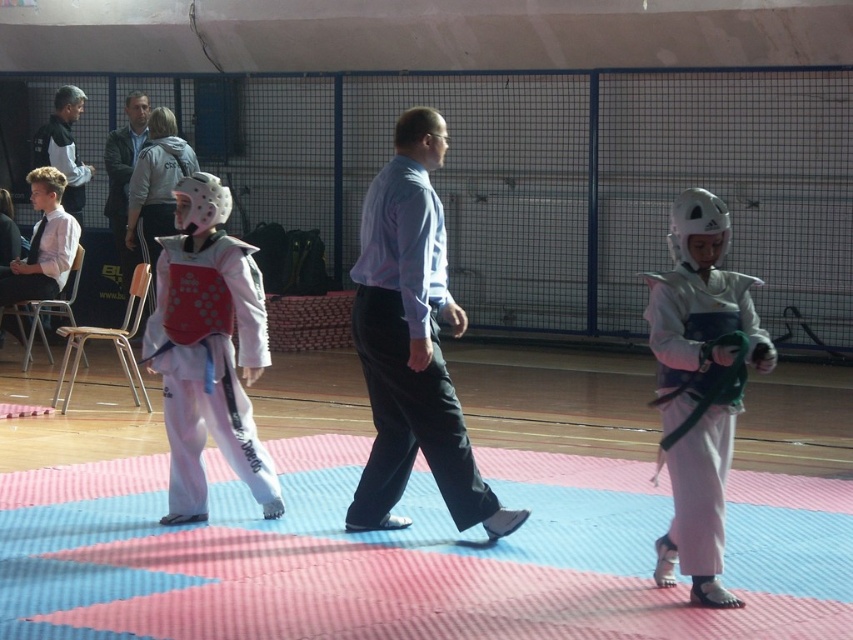
Question: Which of the following is the closest to the observer?

Choices:
 (A) (41, 269)
 (B) (68, 177)

Answer: (A)

Question: Which point is farther to the camera?

Choices:
 (A) click(697, 460)
 (B) click(361, 282)
 (C) click(44, 189)

Answer: (C)

Question: Is white matte karate uniform at left thinner than white shirt at left?

Choices:
 (A) no
 (B) yes

Answer: (B)

Question: In this image, where is light blue shirt at upper center located relative to black jacket at upper left?

Choices:
 (A) below
 (B) above

Answer: (A)

Question: Which of these objects is positioned farthest from the white matte karate uniform at left?

Choices:
 (A) black jacket at upper left
 (B) light blue shirt at center

Answer: (A)

Question: Does white shirt at left have a lesser width compared to light blue shirt at upper center?

Choices:
 (A) no
 (B) yes

Answer: (A)